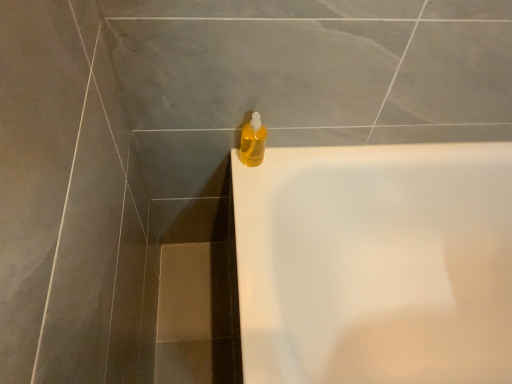
The height and width of the screenshot is (384, 512). What do you see at coordinates (253, 142) in the screenshot?
I see `translucent yellow liquid at upper right` at bounding box center [253, 142].

Locate an element on the screen. Image resolution: width=512 pixels, height=384 pixels. translucent yellow liquid at upper right is located at coordinates (253, 142).

In order to face translucent yellow liquid at upper right, should I rotate leftwards or rightwards?

You should rotate right by 0.114 degrees.

Where is `white glossy bathtub at upper right`? white glossy bathtub at upper right is located at coordinates (376, 264).

Image resolution: width=512 pixels, height=384 pixels. What do you see at coordinates (376, 264) in the screenshot? I see `white glossy bathtub at upper right` at bounding box center [376, 264].

The image size is (512, 384). Find the location of `translucent yellow liquid at upper right`. translucent yellow liquid at upper right is located at coordinates (253, 142).

Which object is positioned more to the left, translucent yellow liquid at upper right or white glossy bathtub at upper right?

Positioned to the left is translucent yellow liquid at upper right.

Is translucent yellow liquid at upper right closer to camera compared to white glossy bathtub at upper right?

That is False.

Is point (247, 149) in front of point (429, 330)?

Yes, point (247, 149) is closer to viewer.

From the image's perspective, is translucent yellow liquid at upper right above or below white glossy bathtub at upper right?

Based on their image positions, translucent yellow liquid at upper right is located above white glossy bathtub at upper right.

From a real-world perspective, between translucent yellow liquid at upper right and white glossy bathtub at upper right, who is vertically lower?

white glossy bathtub at upper right is physically lower.

Considering the sizes of objects translucent yellow liquid at upper right and white glossy bathtub at upper right in the image provided, who is thinner, translucent yellow liquid at upper right or white glossy bathtub at upper right?

Thinner between the two is translucent yellow liquid at upper right.

Is translucent yellow liquid at upper right shorter than white glossy bathtub at upper right?

Yes.

Between translucent yellow liquid at upper right and white glossy bathtub at upper right, which one has larger size?

white glossy bathtub at upper right.

In the scene shown: Choose the correct answer: Is translucent yellow liquid at upper right inside white glossy bathtub at upper right or outside it?

translucent yellow liquid at upper right is outside white glossy bathtub at upper right.

Is translucent yellow liquid at upper right beside white glossy bathtub at upper right?

translucent yellow liquid at upper right and white glossy bathtub at upper right are clearly separated.

Is translucent yellow liquid at upper right positioned with its back to white glossy bathtub at upper right?

translucent yellow liquid at upper right is not turned away from white glossy bathtub at upper right.

In the scene shown: Can you tell me how much translucent yellow liquid at upper right and white glossy bathtub at upper right differ in facing direction?

89 degrees.

In the scene shown: Measure the distance from translucent yellow liquid at upper right to white glossy bathtub at upper right.

They are 18.82 inches apart.

What are the coordinates of `bathtub on the right side of translucent yellow liquid at upper right` in the screenshot? It's located at (376, 264).

Considering the positions of objects white glossy bathtub at upper right and translucent yellow liquid at upper right in the image provided, who is more to the left, white glossy bathtub at upper right or translucent yellow liquid at upper right?

Positioned to the left is translucent yellow liquid at upper right.

Is the depth of white glossy bathtub at upper right greater than that of translucent yellow liquid at upper right?

No, white glossy bathtub at upper right is in front of translucent yellow liquid at upper right.

Does point (445, 313) appear closer or farther from the camera than point (245, 128)?

Point (445, 313) is positioned farther from the camera compared to point (245, 128).

From the picture: From the image's perspective, is white glossy bathtub at upper right located above or below translucent yellow liquid at upper right?

Based on their image positions, white glossy bathtub at upper right is located beneath translucent yellow liquid at upper right.

In the scene shown: From a real-world perspective, who is located higher, white glossy bathtub at upper right or translucent yellow liquid at upper right?

translucent yellow liquid at upper right.

Does white glossy bathtub at upper right have a lesser width compared to translucent yellow liquid at upper right?

Incorrect, the width of white glossy bathtub at upper right is not less than that of translucent yellow liquid at upper right.

Who is taller, white glossy bathtub at upper right or translucent yellow liquid at upper right?

white glossy bathtub at upper right is taller.

Between white glossy bathtub at upper right and translucent yellow liquid at upper right, which one has smaller size?

translucent yellow liquid at upper right.

Would you say white glossy bathtub at upper right is outside translucent yellow liquid at upper right?

Yes.

Is white glossy bathtub at upper right far away from translucent yellow liquid at upper right?

They are positioned close to each other.

Is white glossy bathtub at upper right looking in the opposite direction of translucent yellow liquid at upper right?

No, white glossy bathtub at upper right's orientation is not away from translucent yellow liquid at upper right.

What's the angular difference between white glossy bathtub at upper right and translucent yellow liquid at upper right's facing directions?

89 degrees.

How far apart are white glossy bathtub at upper right and translucent yellow liquid at upper right?

white glossy bathtub at upper right is 18.82 inches from translucent yellow liquid at upper right.

Locate an element on the screen. This screenshot has height=384, width=512. cleaning product on the left of white glossy bathtub at upper right is located at coordinates (253, 142).

Locate an element on the screen. Image resolution: width=512 pixels, height=384 pixels. bathtub in front of the translucent yellow liquid at upper right is located at coordinates (376, 264).

Where is `cleaning product located above the white glossy bathtub at upper right (from a real-world perspective)`? cleaning product located above the white glossy bathtub at upper right (from a real-world perspective) is located at coordinates (253, 142).